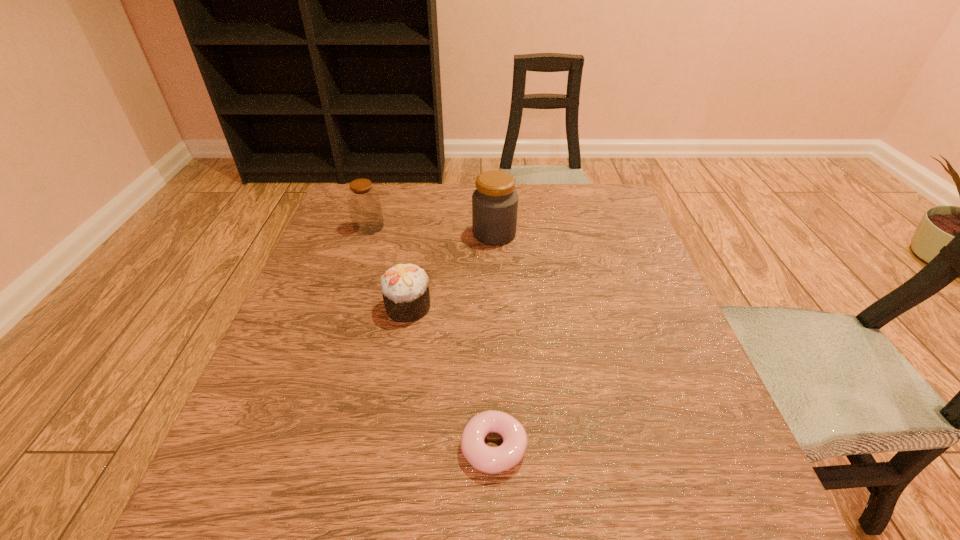
Locate an element on the screen. This screenshot has height=540, width=960. vacant space at the right edge of the desktop is located at coordinates (708, 439).

Where is `vacant region at the far left corner of the desktop`? vacant region at the far left corner of the desktop is located at coordinates pos(342,193).

Where is `free spot at the near left corner of the desktop`? This screenshot has width=960, height=540. free spot at the near left corner of the desktop is located at coordinates (211, 483).

In the image, there is a desktop. Where is `free region at the far right corner`? free region at the far right corner is located at coordinates (598, 205).

Where is `vacant point located between the cupcake and the doughnut`? vacant point located between the cupcake and the doughnut is located at coordinates (451, 377).

Identify the location of unoccupied area between the third object from right to left and the tallest object. This screenshot has height=540, width=960. (451, 271).

This screenshot has width=960, height=540. What are the coordinates of `vacant point located between the second shortest object and the nearest object` in the screenshot? It's located at (451, 377).

Find the location of a particular element. The width and height of the screenshot is (960, 540). empty space between the shorter jar and the doughnut is located at coordinates (431, 336).

What are the coordinates of `free spot between the tallest object and the nearest object` in the screenshot? It's located at (493, 341).

You are a GUI agent. You are given a task and a screenshot of the screen. Output one action in this format:
    pyautogui.click(x=<x>, y=<y>)
    Task: Click on the vacant area between the taller jar and the cupcake
    This screenshot has height=540, width=960.
    Given the screenshot: What is the action you would take?
    pyautogui.click(x=451, y=271)